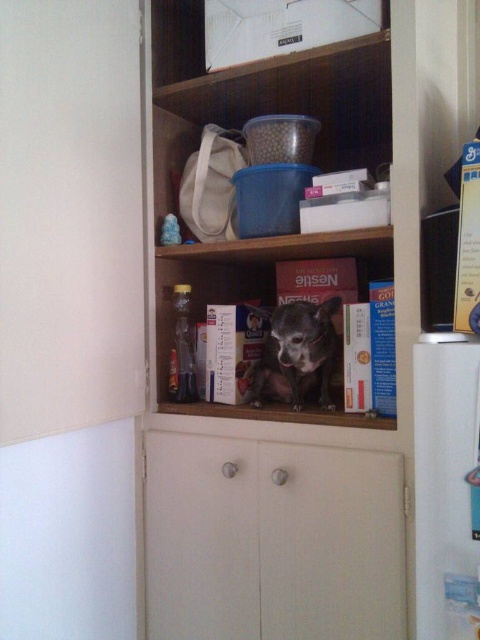
You are standing in a kitchen and see a white glossy refrigerator at right and a fuzzy brown dog at center. Which object is located to the right of the other?

The white glossy refrigerator at right is located to the right of the fuzzy brown dog at center.

You are standing in a kitchen and want to reach an item on the wooden bookshelf at upper center. If your maximum reaching height is 24 inches, can you comfortably reach it?

The wooden bookshelf at upper center is 27.79 inches away from the camera, which is higher than your maximum reaching height of 24 inches. Therefore, you would not be able to comfortably reach the item on the wooden bookshelf at upper center.

From the picture: You are standing in a kitchen and need to place a new appliance. Where should you place the white glossy refrigerator at right based on its current position coordinates?

The white glossy refrigerator at right is already positioned at coordinates point (446,486), so you should place it there.